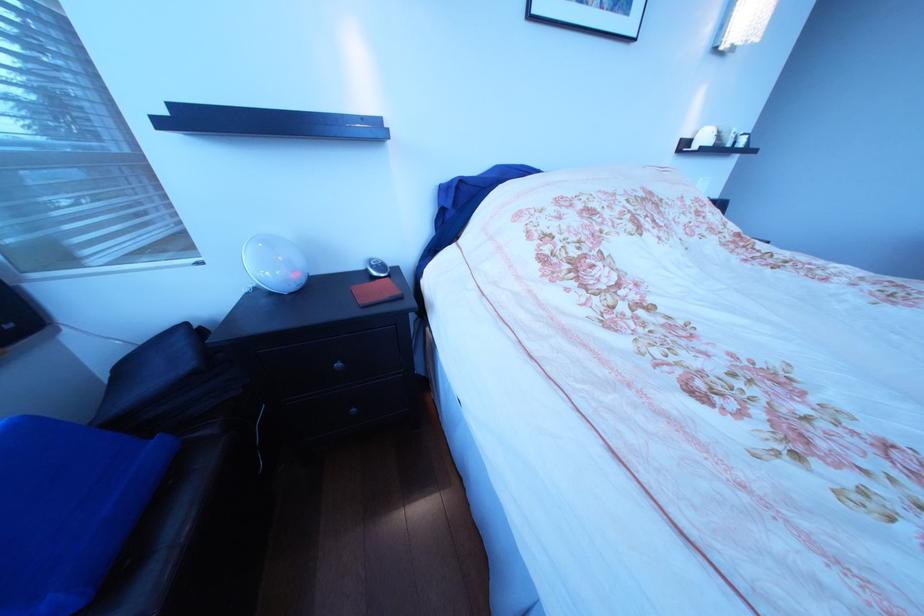
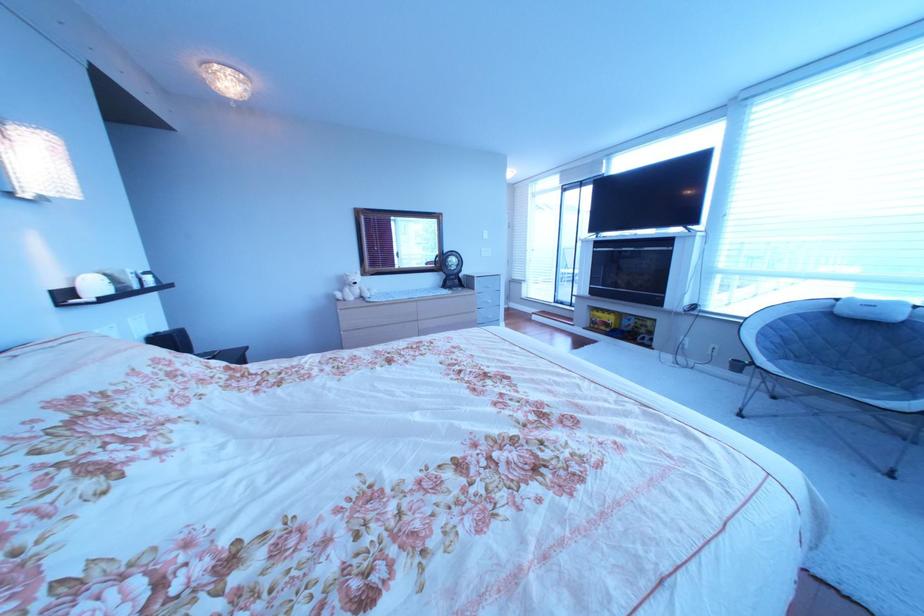
How did the camera likely rotate?

The camera rotated toward right-down.